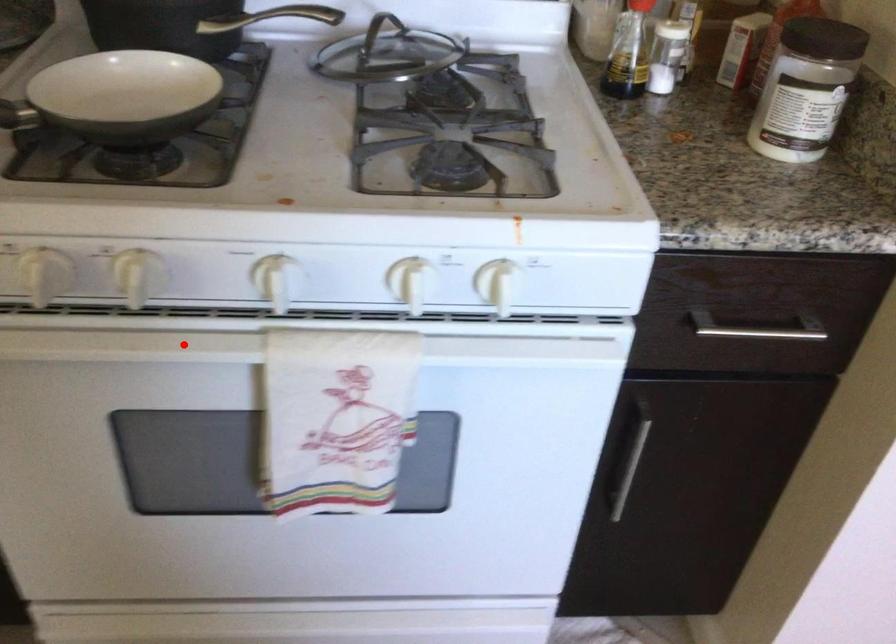
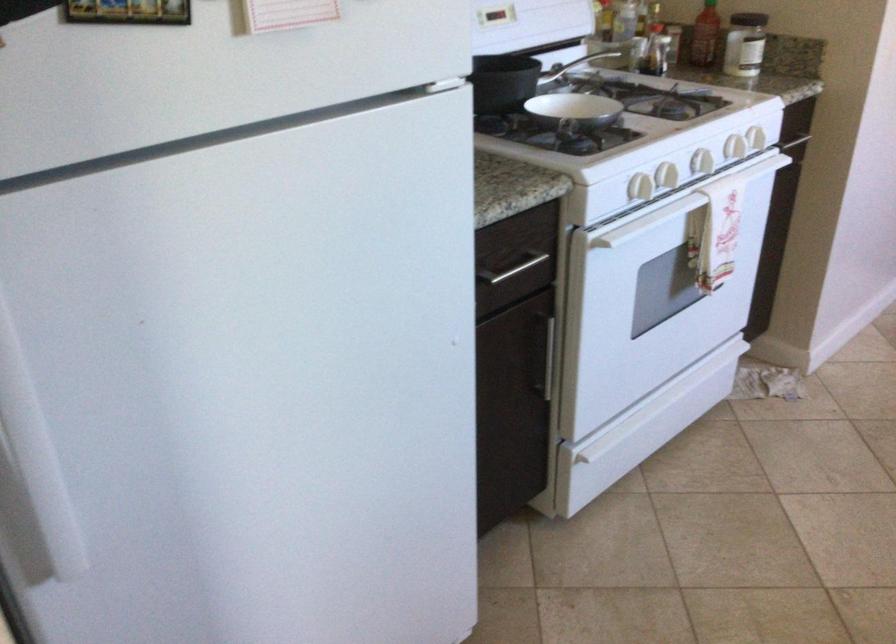
Where in the second image is the point corresponding to the highlighted location from the first image?

(702, 162)